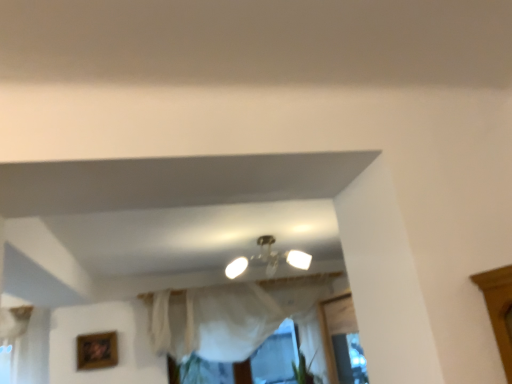
Question: Would you say wooden picture frame at lower left is inside or outside white sheer curtain at center?

Choices:
 (A) inside
 (B) outside

Answer: (B)

Question: From a real-world perspective, is wooden picture frame at lower left physically located above or below white sheer curtain at center?

Choices:
 (A) above
 (B) below

Answer: (A)

Question: Considering the real-world distances, which object is farthest from the matte white ceiling light at center?

Choices:
 (A) wooden picture frame at lower left
 (B) white sheer curtain at center
 (C) green leafy plant at lower center

Answer: (A)

Question: Which is farther from the matte white ceiling light at center?

Choices:
 (A) white sheer curtain at center
 (B) green leafy plant at lower center
 (C) wooden picture frame at lower left

Answer: (C)